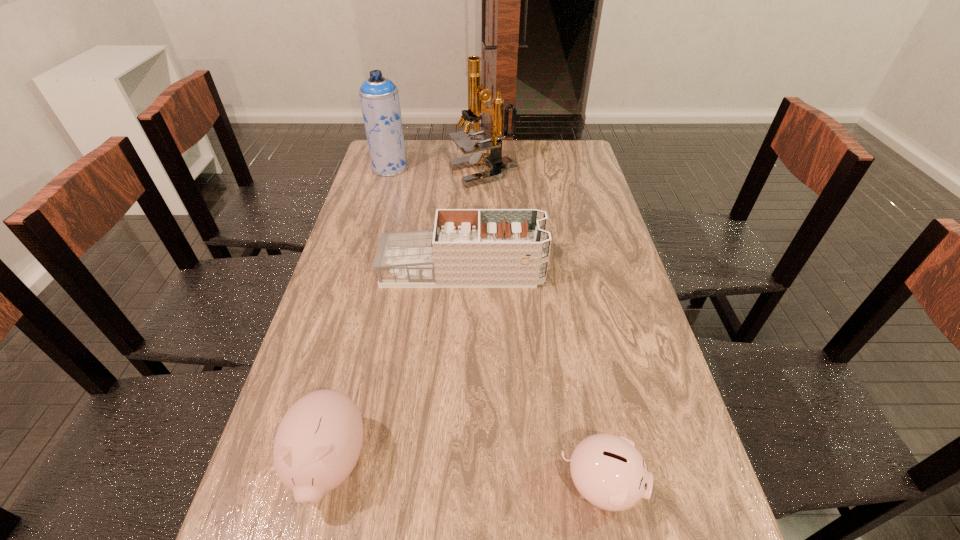
Where is `vacant space at the left edge`? This screenshot has height=540, width=960. vacant space at the left edge is located at coordinates (318, 357).

Where is `free space at the right edge of the desktop`? This screenshot has height=540, width=960. free space at the right edge of the desktop is located at coordinates (594, 239).

Find the location of `free spot between the aerosol can and the taller piggy bank`. free spot between the aerosol can and the taller piggy bank is located at coordinates (360, 316).

Where is `vacant space in between the microscope and the right piggy bank`? vacant space in between the microscope and the right piggy bank is located at coordinates (542, 329).

Where is `empty space that is in between the third farthest object and the shorter piggy bank`? empty space that is in between the third farthest object and the shorter piggy bank is located at coordinates (532, 379).

Identify the location of free space that is in between the right piggy bank and the left piggy bank. click(x=466, y=475).

Locate an element on the screen. This screenshot has height=540, width=960. free space between the third farthest object and the aerosol can is located at coordinates (426, 219).

The height and width of the screenshot is (540, 960). Find the location of `free spot between the left piggy bank and the shortest object`. free spot between the left piggy bank and the shortest object is located at coordinates (466, 475).

Where is `free space between the microscope and the right piggy bank`? Image resolution: width=960 pixels, height=540 pixels. free space between the microscope and the right piggy bank is located at coordinates (542, 329).

At what (x,y) coordinates should I click in order to perform the action: click on free space that is in between the taller piggy bank and the dollhouse. Please return your answer as a coordinate pair (x, y). The width and height of the screenshot is (960, 540). Looking at the image, I should click on (396, 368).